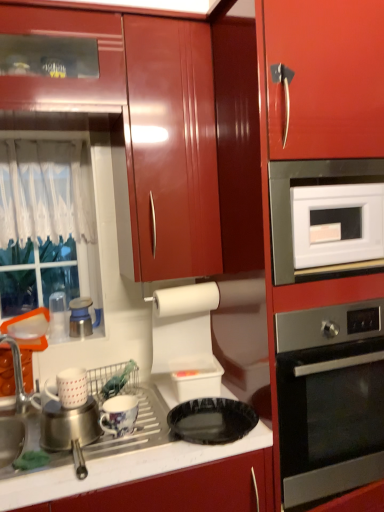
The image size is (384, 512). In order to click on stainless steel oven at right in this screenshot , I will do tap(330, 399).

What do you see at coordinates (212, 420) in the screenshot?
I see `black glossy plate at lower center` at bounding box center [212, 420].

This screenshot has height=512, width=384. Identify the location of glossy ceramic mug at lower center, which ranks as the second appliance in back-to-front order. (119, 415).

Where is `glossy wood cabinet at upper center`? glossy wood cabinet at upper center is located at coordinates (144, 125).

This screenshot has width=384, height=512. Describe the element at coordinates (80, 317) in the screenshot. I see `satin silver kettle at upper left, the 1th appliance viewed from the back` at that location.

You are a GUI agent. You are given a task and a screenshot of the screen. Output one action in this format:
    pyautogui.click(x=<x>, y=<y>)
    Task: Click on the brushed metal sink at lower left
    This screenshot has width=384, height=512.
    Given the screenshot: What is the action you would take?
    pyautogui.click(x=11, y=441)

The width and height of the screenshot is (384, 512). In order to click on white sheer curtain at left in this screenshot , I will do `click(46, 191)`.

This screenshot has width=384, height=512. I want to click on stainless steel oven at right, so click(330, 399).

Can you confirm if glossy wood cabinet at upper center is taller than white glossy microwave oven at upper right?

Yes, glossy wood cabinet at upper center is taller than white glossy microwave oven at upper right.

From the image's perspective, relative to white glossy microwave oven at upper right, is glossy wood cabinet at upper center above or below?

glossy wood cabinet at upper center is situated higher than white glossy microwave oven at upper right in the image.

Is glossy wood cabinet at upper center looking in the opposite direction of white glossy microwave oven at upper right?

glossy wood cabinet at upper center does not have its back to white glossy microwave oven at upper right.

From a real-world perspective, is glossy wood cabinet at upper center on white glossy microwave oven at upper right?

Indeed, from a real-world perspective, glossy wood cabinet at upper center stands above white glossy microwave oven at upper right.

Locate an element on the screen. This screenshot has width=384, height=512. home appliance located on the right of glossy ceramic mug at lower center, marked as the second appliance in a front-to-back arrangement is located at coordinates (330, 399).

From the image's perspective, which one is positioned lower, glossy ceramic mug at lower center, positioned as the third appliance in left-to-right order, or stainless steel oven at right?

glossy ceramic mug at lower center, positioned as the third appliance in left-to-right order, is shown below in the image.

In the scene shown: Is glossy ceramic mug at lower center, which ranks as the second appliance in back-to-front order, turned away from stainless steel oven at right?

No, glossy ceramic mug at lower center, which ranks as the second appliance in back-to-front order,'s orientation is not away from stainless steel oven at right.

Is glossy ceramic mug at lower center, arranged as the first appliance when viewed from the right, not within stainless steel oven at right?

glossy ceramic mug at lower center, arranged as the first appliance when viewed from the right, is positioned outside stainless steel oven at right.

Which is more to the right, white sheer curtain at left or black glossy plate at lower center?

From the viewer's perspective, black glossy plate at lower center appears more on the right side.

Which object is thinner, white sheer curtain at left or black glossy plate at lower center?

With smaller width is white sheer curtain at left.

Locate an element on the screen. The width and height of the screenshot is (384, 512). curtain to the left of black glossy plate at lower center is located at coordinates (46, 191).

Does white sheer curtain at left come in front of black glossy plate at lower center?

No.

Where is `sink below the white matte mug at lower left, the third appliance in the back-to-front sequence (from the image's perspective)`? sink below the white matte mug at lower left, the third appliance in the back-to-front sequence (from the image's perspective) is located at coordinates (11, 441).

Looking at this image, from the image's perspective, is brushed metal sink at lower left below white matte mug at lower left, the third appliance in the back-to-front sequence?

Correct, brushed metal sink at lower left appears lower than white matte mug at lower left, the third appliance in the back-to-front sequence, in the image.

Is brushed metal sink at lower left placed right next to white matte mug at lower left, which is the 2th appliance in top-to-bottom order?

brushed metal sink at lower left is not next to white matte mug at lower left, which is the 2th appliance in top-to-bottom order, and they're not touching.

Can you confirm if stainless steel oven at right is shorter than white sheer curtain at left?

No.

Is stainless steel oven at right in front of white sheer curtain at left?

Yes, stainless steel oven at right is closer to the viewer.

Is stainless steel oven at right facing away from white sheer curtain at left?

stainless steel oven at right does not have its back to white sheer curtain at left.

Which of these two, stainless steel oven at right or white sheer curtain at left, is smaller?

With smaller size is white sheer curtain at left.

From the image's perspective, is brushed metal sink at lower left below satin silver kettle at upper left, which appears as the 1th appliance when viewed from the top?

Yes.

Is brushed metal sink at lower left to the right of satin silver kettle at upper left, the 1th appliance viewed from the back, from the viewer's perspective?

No, brushed metal sink at lower left is not to the right of satin silver kettle at upper left, the 1th appliance viewed from the back.

How different are the orientations of brushed metal sink at lower left and satin silver kettle at upper left, the 1th appliance in the left-to-right sequence, in degrees?

The angle between the facing direction of brushed metal sink at lower left and the facing direction of satin silver kettle at upper left, the 1th appliance in the left-to-right sequence, is 0.701 degrees.

Does brushed metal sink at lower left come in front of satin silver kettle at upper left, marked as the third appliance in a bottom-to-top arrangement?

Yes, the depth of brushed metal sink at lower left is less than that of satin silver kettle at upper left, marked as the third appliance in a bottom-to-top arrangement.

Can you confirm if white glossy microwave oven at upper right is shorter than glossy wood cabinet at upper center?

Correct, white glossy microwave oven at upper right is not as tall as glossy wood cabinet at upper center.

What's the angular difference between white glossy microwave oven at upper right and glossy wood cabinet at upper center's facing directions?

The angle between the facing direction of white glossy microwave oven at upper right and the facing direction of glossy wood cabinet at upper center is 6.36 degrees.

From the image's perspective, which is above, white glossy microwave oven at upper right or glossy wood cabinet at upper center?

glossy wood cabinet at upper center.

Considering the positions of point (375, 169) and point (204, 247), is point (375, 169) closer or farther from the camera than point (204, 247)?

Clearly, point (375, 169) is closer to the camera than point (204, 247).

Find the location of `cabinetry in front of the white glossy microwave oven at upper right`. cabinetry in front of the white glossy microwave oven at upper right is located at coordinates (144, 125).

Find the location of `home appliance located above the glossy ceramic mug at lower center, which ranks as the second appliance in back-to-front order (from a real-world perspective)`. home appliance located above the glossy ceramic mug at lower center, which ranks as the second appliance in back-to-front order (from a real-world perspective) is located at coordinates (330, 399).

Estimate the real-world distances between objects in this image. Which object is closer to brushed metal sink at lower left, satin silver kettle at upper left, marked as the third appliance in a bottom-to-top arrangement, or white matte mug at lower left, which is counted as the first appliance, starting from the front?

The object closer to brushed metal sink at lower left is white matte mug at lower left, which is counted as the first appliance, starting from the front.

Which object lies nearer to the anchor point white matte mug at lower left, which is counted as the first appliance, starting from the front, satin silver kettle at upper left, the 1th appliance viewed from the back, or stainless steel oven at right?

satin silver kettle at upper left, the 1th appliance viewed from the back, lies closer to white matte mug at lower left, which is counted as the first appliance, starting from the front, than the other object.

When comparing their distances from glossy wood cabinet at upper center, does stainless steel oven at right or brushed metal sink at lower left seem closer?

stainless steel oven at right is positioned closer to the anchor glossy wood cabinet at upper center.

Considering their positions, is black glossy plate at lower center positioned further to glossy ceramic mug at lower center, marked as the second appliance in a front-to-back arrangement, than satin silver kettle at upper left, which ranks as the third appliance in right-to-left order?

Among the two, satin silver kettle at upper left, which ranks as the third appliance in right-to-left order, is located further to glossy ceramic mug at lower center, marked as the second appliance in a front-to-back arrangement.

From the image, which object appears to be nearer to white sheer curtain at left, glossy wood cabinet at upper center or white matte mug at lower left, the third appliance in the back-to-front sequence?

glossy wood cabinet at upper center is positioned closer to the anchor white sheer curtain at left.

Considering their positions, is satin silver kettle at upper left, acting as the third appliance starting from the front, positioned closer to white sheer curtain at left than white glossy microwave oven at upper right?

Based on the image, satin silver kettle at upper left, acting as the third appliance starting from the front, appears to be nearer to white sheer curtain at left.

Based on their spatial positions, is white matte mug at lower left, which is the 2th appliance in top-to-bottom order, or satin silver kettle at upper left, the 1th appliance viewed from the back, closer to glossy ceramic mug at lower center, positioned as the third appliance in left-to-right order?

The object closer to glossy ceramic mug at lower center, positioned as the third appliance in left-to-right order, is white matte mug at lower left, which is the 2th appliance in top-to-bottom order.

Estimate the real-world distances between objects in this image. Which object is further from white glossy microwave oven at upper right, white matte mug at lower left, which is the 2th appliance in top-to-bottom order, or black glossy plate at lower center?

white matte mug at lower left, which is the 2th appliance in top-to-bottom order, is further to white glossy microwave oven at upper right.

The width and height of the screenshot is (384, 512). What are the coordinates of `sink that lies between white sheer curtain at left and black glossy plate at lower center from top to bottom` in the screenshot? It's located at (11, 441).

This screenshot has height=512, width=384. Identify the location of curtain between glossy wood cabinet at upper center and white matte mug at lower left, which is counted as the first appliance, starting from the front, from top to bottom. (46, 191).

The height and width of the screenshot is (512, 384). I want to click on microwave oven between glossy ceramic mug at lower center, which is counted as the 3th appliance, starting from the top, and stainless steel oven at right, in the horizontal direction, so click(x=291, y=215).

The image size is (384, 512). Find the location of `gas stove between brushed metal sink at lower left and white glossy microwave oven at upper right in the horizontal direction`. gas stove between brushed metal sink at lower left and white glossy microwave oven at upper right in the horizontal direction is located at coordinates (212, 420).